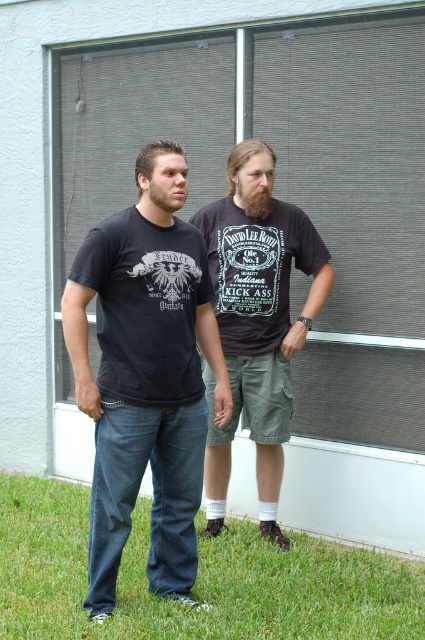
Question: Does matte black t-shirt at center have a smaller size compared to brownhairbeard at center?

Choices:
 (A) no
 (B) yes

Answer: (A)

Question: Which of these objects is positioned closest to the brown fuzzy beard at center?

Choices:
 (A) gray mesh screen door at center
 (B) matte black t-shirt at center
 (C) brownhairbeard at center
 (D) green grass at lower center

Answer: (B)

Question: Is matte black t-shirt at center bigger than green grass at lower center?

Choices:
 (A) no
 (B) yes

Answer: (A)

Question: Is dark gray cotton t-shirt at center thinner than brown fuzzy beard at center?

Choices:
 (A) no
 (B) yes

Answer: (A)

Question: Which object is the farthest from the gray mesh screen door at center?

Choices:
 (A) matte black t-shirt at center
 (B) brown fuzzy beard at center
 (C) dark gray cotton t-shirt at center
 (D) brownhairbeard at center

Answer: (B)

Question: Among these points, which one is nearest to the camera?

Choices:
 (A) (362, 212)
 (B) (186, 180)
 (C) (136, 381)
 (D) (132, 589)

Answer: (C)